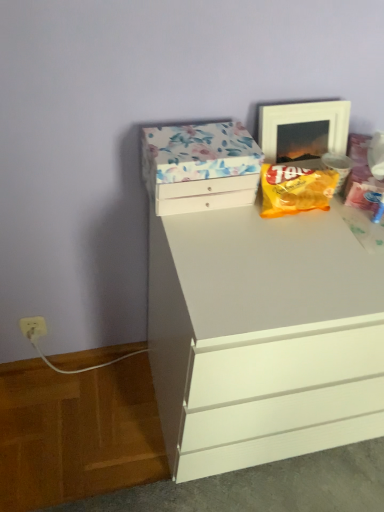
Where is `free space in front of floral paper-covered box at upper center`? This screenshot has width=384, height=512. free space in front of floral paper-covered box at upper center is located at coordinates (218, 243).